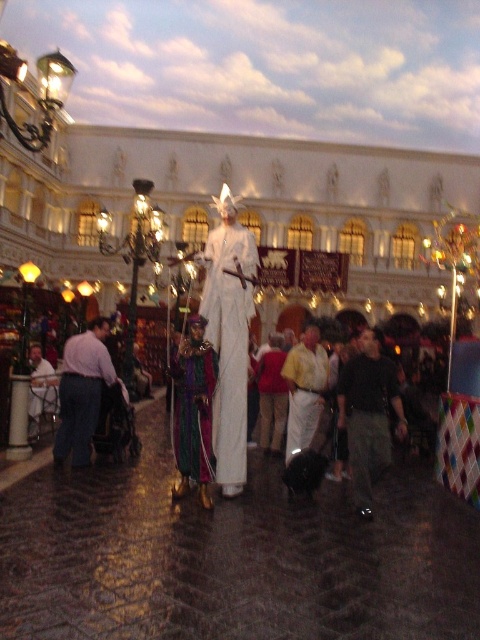
Based on the photo, is white fabric statue at center thinner than black cotton pants at center?

Yes.

Between point (224, 444) and point (373, 387), which one is positioned behind?

Positioned behind is point (373, 387).

You are a GUI agent. You are given a task and a screenshot of the screen. Output one action in this format:
    pyautogui.click(x=<x>, y=<y>)
    Task: Click on the white fabric statue at center
    This screenshot has height=640, width=480.
    Given the screenshot: What is the action you would take?
    click(x=228, y=342)

Can you confirm if light pink shirt at center is thinner than multicolored velvet robe at center?

No, light pink shirt at center is not thinner than multicolored velvet robe at center.

Who is positioned more to the left, light pink shirt at center or multicolored velvet robe at center?

Positioned to the left is light pink shirt at center.

The image size is (480, 640). I want to click on light pink shirt at center, so click(x=83, y=392).

Who is positioned more to the left, black cotton pants at center or white cotton shirt at center?

white cotton shirt at center

Is point (358, 397) in front of point (314, 406)?

That is True.

The width and height of the screenshot is (480, 640). What are the coordinates of `black cotton pants at center` in the screenshot? It's located at (368, 413).